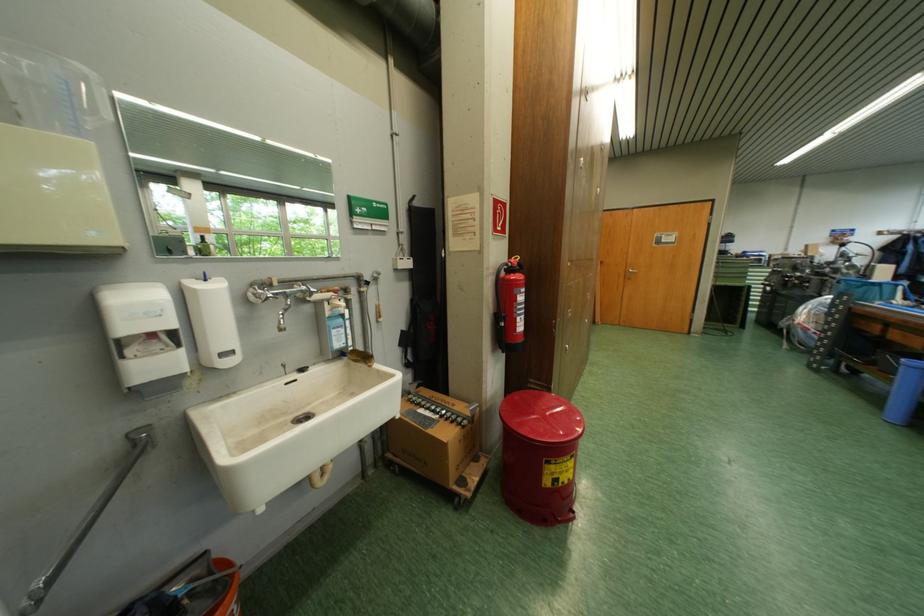
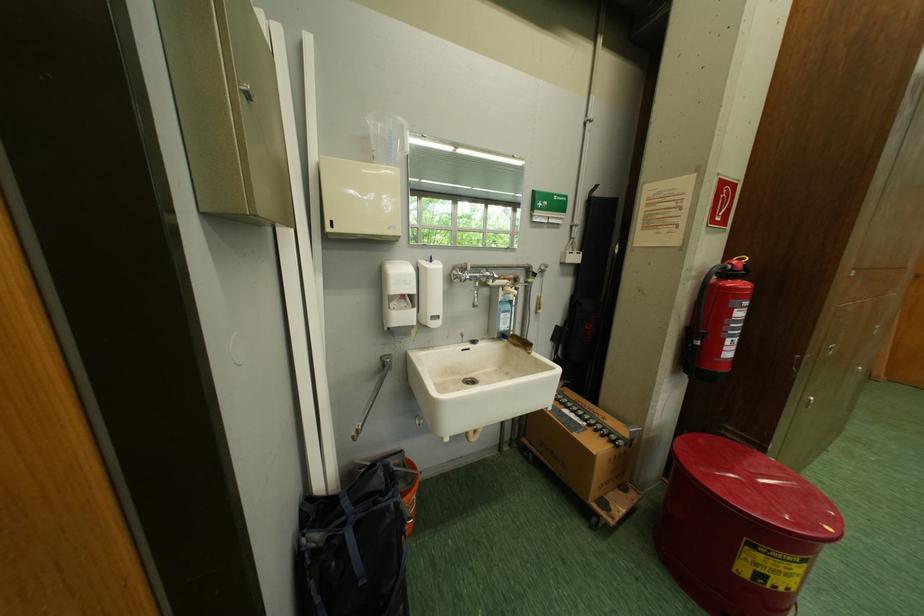
Where in the second image is the point corresponding to (x=505, y=314) from the first image?

(699, 328)